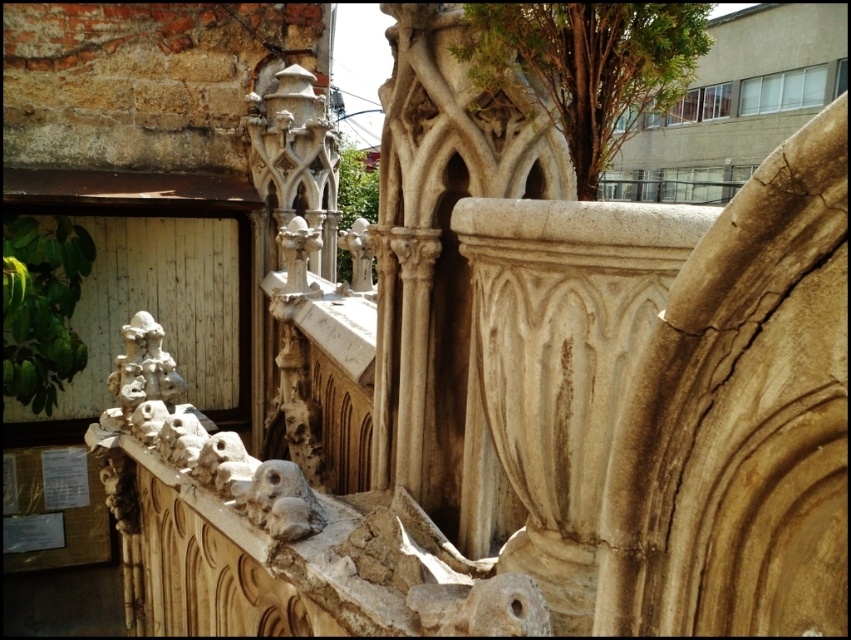
You are an architect analyzing the spatial dimensions of the historical structure. Given that the carved stone sculpture at lower left and the stone carving at center are both part of the same architectural design, which one would require more material based on their sizes?

The carved stone sculpture at lower left requires more material because its width is larger than the stone carving at center.

You are an architect analyzing the architectural details in the image. You notice two elements, the carved stone sculpture at lower left and the stone carving at center. Which of these two elements is located to the left of the other?

The carved stone sculpture at lower left is positioned on the left side of the stone carving at center.

You are an architect analyzing the image of the historical building. You need to locate the carved stone sculpture at lower left. Where exactly is it positioned in the image?

The carved stone sculpture at lower left is positioned at point (141, 371).